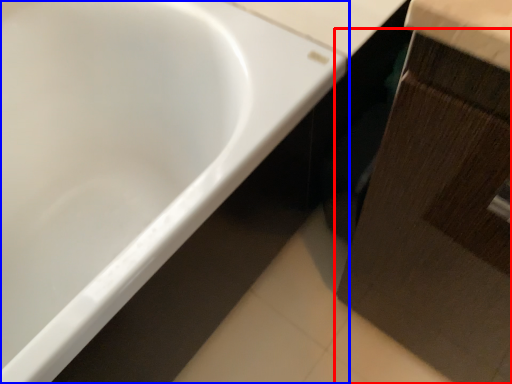
Question: Which object is closer to the camera taking this photo, cabinetry (highlighted by a red box) or bathtub (highlighted by a blue box)?

Choices:
 (A) cabinetry
 (B) bathtub

Answer: (A)